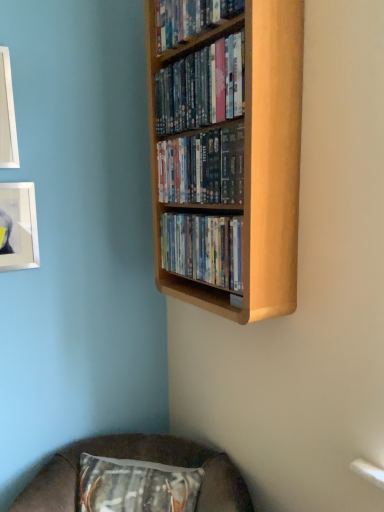
Question: Based on their sizes in the image, would you say brown fabric cushion at lower center is bigger or smaller than shiny plastic dvds at center, acting as the second book starting from the bottom?

Choices:
 (A) big
 (B) small

Answer: (A)

Question: Relative to shiny plastic dvds at center, arranged as the 3th book when viewed from the top, is brown fabric cushion at lower center in front or behind?

Choices:
 (A) behind
 (B) front

Answer: (A)

Question: Estimate the real-world distances between objects in this image. Which object is closer to the wooden shelf at upper center, the fourth book when ordered from bottom to top?

Choices:
 (A) shiny plastic dvds at center, acting as the second book starting from the bottom
 (B) matte plastic dvds at center, which ranks as the first book in bottom-to-top order
 (C) wooden shelf at upper center, which appears as the 2th book when viewed from the top
 (D) light wood bookcase at upper center
 (E) white glossy picture frame at upper left, the second picture frame from the bottom

Answer: (C)

Question: Estimate the real-world distances between objects in this image. Which object is farther from the brown fabric cushion at lower center?

Choices:
 (A) shiny plastic dvds at center, arranged as the 3th book when viewed from the top
 (B) light wood bookcase at upper center
 (C) wooden shelf at upper center, which is the first book from top to bottom
 (D) matte plastic dvds at center, which ranks as the first book in bottom-to-top order
 (E) white glossy picture frame at upper left, the second picture frame from the bottom

Answer: (C)